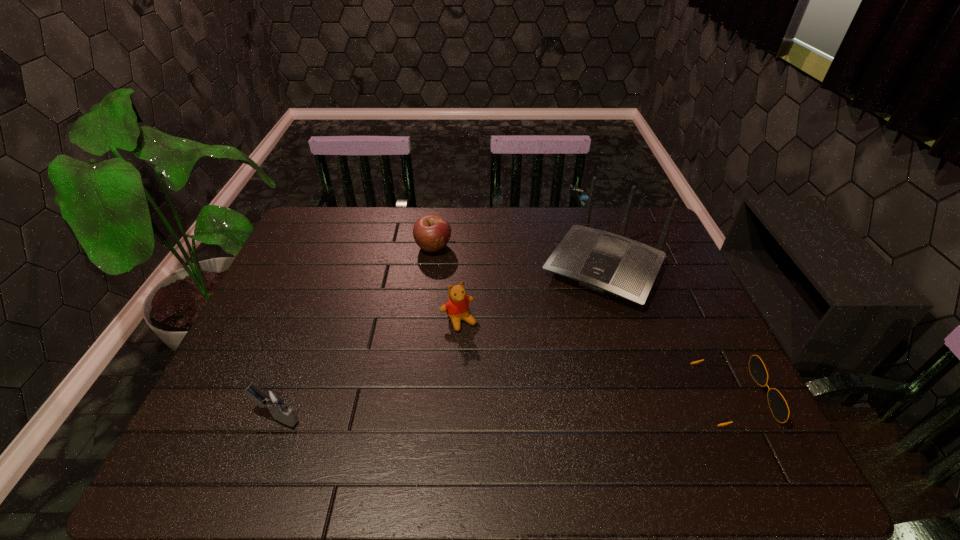
Identify the location of free region at the near left corner of the desktop. The image size is (960, 540). (241, 428).

In the image, there is a desktop. Where is `vacant space at the far right corner`? This screenshot has width=960, height=540. vacant space at the far right corner is located at coordinates (631, 214).

You are a GUI agent. You are given a task and a screenshot of the screen. Output one action in this format:
    pyautogui.click(x=<x>, y=<y>)
    Task: Click on the vacant region at the near right corner of the desktop
    The height and width of the screenshot is (540, 960).
    Given the screenshot: What is the action you would take?
    706,409

Find the location of `vacant area that lies between the router and the igniter`. vacant area that lies between the router and the igniter is located at coordinates (440, 342).

This screenshot has height=540, width=960. I want to click on free space between the router and the apple, so click(518, 257).

Identify the location of vacant space that is in between the shortest object and the second shortest object. (584, 321).

Find the location of a particular element. The image size is (960, 540). vacant point located between the leftmost object and the shortest object is located at coordinates (504, 406).

Find the location of a particular element. vacant space that's between the igniter and the second shortest object is located at coordinates (354, 332).

At what (x,y) coordinates should I click in order to perform the action: click on free area in between the teddy bear and the igniter. Please return your answer as a coordinate pair (x, y). Looking at the image, I should click on (367, 369).

You are a GUI agent. You are given a task and a screenshot of the screen. Output one action in this format:
    pyautogui.click(x=<x>, y=<y>)
    Task: Click on the free space between the router and the teddy bear
    This screenshot has width=960, height=540.
    Given the screenshot: What is the action you would take?
    pyautogui.click(x=531, y=294)